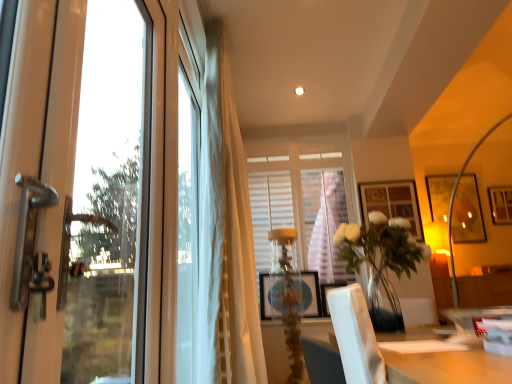
Based on the photo, what is the approximate height of wooden picture frame at upper right, which is the first picture frame from back to front?

It is 40.49 centimeters.

Image resolution: width=512 pixels, height=384 pixels. Describe the element at coordinates (392, 202) in the screenshot. I see `wooden framed picture at center right, positioned as the 3th picture frame in front-to-back order` at that location.

Where is `wooden picture frame at upper right, which is the fifth picture frame from left to right`? This screenshot has height=384, width=512. wooden picture frame at upper right, which is the fifth picture frame from left to right is located at coordinates (500, 204).

Which object is closer to the camera, wooden framed picture at center right, which ranks as the 3th picture frame in back-to-front order, or clear glass door at left, the first window positioned from the left?

clear glass door at left, the first window positioned from the left, is more forward.

Is wooden framed picture at center right, the 3th picture frame in the left-to-right sequence, situated inside clear glass door at left, the first window positioned from the left, or outside?

wooden framed picture at center right, the 3th picture frame in the left-to-right sequence, is located beyond the bounds of clear glass door at left, the first window positioned from the left.

Who is smaller, wooden framed picture at center right, which ranks as the 3th picture frame in back-to-front order, or clear glass door at left, which is counted as the 2th window, starting from the right?

wooden framed picture at center right, which ranks as the 3th picture frame in back-to-front order, is smaller.

From a real-world perspective, which object stands above the other?

matte black picture frame at center, the 5th picture frame in the back-to-front sequence.

How distant is matte black picture frame at center, which appears as the 1th picture frame when viewed from the front, from white glossy table at lower right?

They are 2.08 meters apart.

Does matte black picture frame at center, the second picture frame from the left, have a greater height compared to white glossy table at lower right?

No.

Can you tell me how much matte black picture frame at center, marked as the fourth picture frame in a right-to-left arrangement, and white glossy table at lower right differ in facing direction?

87.4 degrees.

Which of these two, clear glass door at left, which is the 2th window from back to front, or clear glass vase at center, is wider?

Wider between the two is clear glass vase at center.

Where is `window in front of the clear glass vase at center`? Image resolution: width=512 pixels, height=384 pixels. window in front of the clear glass vase at center is located at coordinates (93, 191).

Who is more distant, clear glass door at left, which is counted as the 2th window, starting from the right, or clear glass vase at center?

clear glass vase at center is behind.

Are clear glass door at left, the first window positioned from the left, and clear glass vase at center making contact?

No, clear glass door at left, the first window positioned from the left, is not in contact with clear glass vase at center.

Who is smaller, matte black picture frame at center, which appears as the 1th picture frame when viewed from the front, or clear glass door at left, which is the 2th window from back to front?

matte black picture frame at center, which appears as the 1th picture frame when viewed from the front, is smaller.

Looking at this image, from the image's perspective, is matte black picture frame at center, the 5th picture frame in the back-to-front sequence, above clear glass door at left, which is the 2th window from back to front?

Actually, matte black picture frame at center, the 5th picture frame in the back-to-front sequence, appears below clear glass door at left, which is the 2th window from back to front, in the image.

Is there a large distance between matte black picture frame at center, marked as the fourth picture frame in a right-to-left arrangement, and clear glass door at left, which is the 2th window from back to front?

matte black picture frame at center, marked as the fourth picture frame in a right-to-left arrangement, is far away from clear glass door at left, which is the 2th window from back to front.

Between matte black picture frame at center, which appears as the 1th picture frame when viewed from the front, and clear glass door at left, which is counted as the 2th window, starting from the right, which one has larger width?

Wider between the two is clear glass door at left, which is counted as the 2th window, starting from the right.

Between white matte window at center, arranged as the 2th window when viewed from the front, and clear glass door at left, the first window positioned from the left, which one has smaller width?

With smaller width is white matte window at center, arranged as the 2th window when viewed from the front.

Does white matte window at center, the 1th window from the back, appear on the right side of clear glass door at left, which is counted as the 2th window, starting from the right?

Yes.

Is white matte window at center, the 1th window from the back, positioned behind clear glass door at left, the 1th window viewed from the front?

Yes, it is behind clear glass door at left, the 1th window viewed from the front.

From the image's perspective, is white matte window at center, which ranks as the first window in right-to-left order, located above or below clear glass door at left, which is the 2th window from back to front?

white matte window at center, which ranks as the first window in right-to-left order, is situated lower than clear glass door at left, which is the 2th window from back to front, in the image.

Is wooden framed picture at center right, positioned as the 3th picture frame in front-to-back order, at the right side of white glossy table at lower right?

Correct, you'll find wooden framed picture at center right, positioned as the 3th picture frame in front-to-back order, to the right of white glossy table at lower right.

Which is in front, wooden framed picture at center right, the 3th picture frame in the right-to-left sequence, or white glossy table at lower right?

white glossy table at lower right is closer to the camera.

Measure the distance from wooden framed picture at center right, the 3th picture frame in the right-to-left sequence, to white glossy table at lower right.

wooden framed picture at center right, the 3th picture frame in the right-to-left sequence, is 6.34 feet away from white glossy table at lower right.

Considering the sizes of objects wooden framed picture at center right, which ranks as the 3th picture frame in back-to-front order, and white glossy table at lower right in the image provided, who is taller, wooden framed picture at center right, which ranks as the 3th picture frame in back-to-front order, or white glossy table at lower right?

wooden framed picture at center right, which ranks as the 3th picture frame in back-to-front order.

From the picture: Is white sheer curtain at center inside white matte window at center, which is the second window in left-to-right order?

No, white sheer curtain at center is located outside of white matte window at center, which is the second window in left-to-right order.

Is white matte window at center, which ranks as the first window in right-to-left order, not close to white sheer curtain at center?

Indeed, white matte window at center, which ranks as the first window in right-to-left order, is not near white sheer curtain at center.

Between white matte window at center, the 1th window from the back, and white sheer curtain at center, which one has more height?

Standing taller between the two is white sheer curtain at center.

Between point (283, 225) and point (243, 303), which one is positioned behind?

The point (283, 225) is farther from the camera.

Where is `the 2nd window in front of the wooden framed picture at center right, the 3th picture frame in the right-to-left sequence, counting from the anchor's position`? the 2nd window in front of the wooden framed picture at center right, the 3th picture frame in the right-to-left sequence, counting from the anchor's position is located at coordinates (93, 191).

This screenshot has height=384, width=512. What are the coordinates of `table that is on the right side of matte black picture frame at center, which appears as the 1th picture frame when viewed from the front` in the screenshot? It's located at (448, 366).

From the image, which object appears to be nearer to gold-framed picture at right, which ranks as the 4th picture frame in left-to-right order, wooden picture frame at upper right, which is the first picture frame from back to front, or wooden framed picture at center right, which ranks as the 3th picture frame in back-to-front order?

The object closer to gold-framed picture at right, which ranks as the 4th picture frame in left-to-right order, is wooden picture frame at upper right, which is the first picture frame from back to front.

When comparing their distances from wooden framed picture at center right, the 3th picture frame in the right-to-left sequence, does clear glass door at left, which is counted as the 2th window, starting from the right, or transparent glass window screen at left seem closer?

clear glass door at left, which is counted as the 2th window, starting from the right, is closer to wooden framed picture at center right, the 3th picture frame in the right-to-left sequence.

Based on their spatial positions, is gold-framed picture at right, marked as the second picture frame in a back-to-front arrangement, or white matte window at center, the 1th window from the back, further from transparent glass window screen at left?

gold-framed picture at right, marked as the second picture frame in a back-to-front arrangement, is further to transparent glass window screen at left.

From the image, which object appears to be farther from clear glass vase at center, matte black picture frame at center, the 5th picture frame in the back-to-front sequence, or wooden framed picture at center right, the 3th picture frame in the left-to-right sequence?

Based on the image, matte black picture frame at center, the 5th picture frame in the back-to-front sequence, appears to be further to clear glass vase at center.

Considering their positions, is matte wooden picture frame at center, the 1th picture frame viewed from the left, positioned closer to clear glass vase at center than clear glass door at left, the 1th window viewed from the front?

matte wooden picture frame at center, the 1th picture frame viewed from the left, is positioned closer to the anchor clear glass vase at center.

From the image, which object appears to be nearer to clear glass vase at center, white sheer curtain at center or wooden framed picture at center right, which ranks as the 3th picture frame in back-to-front order?

wooden framed picture at center right, which ranks as the 3th picture frame in back-to-front order, lies closer to clear glass vase at center than the other object.

When comparing their distances from clear glass door at left, which is counted as the 2th window, starting from the right, does transparent glass window screen at left or wooden picture frame at upper right, which ranks as the 5th picture frame in front-to-back order, seem further?

wooden picture frame at upper right, which ranks as the 5th picture frame in front-to-back order, is positioned further to the anchor clear glass door at left, which is counted as the 2th window, starting from the right.

Estimate the real-world distances between objects in this image. Which object is further from wooden framed picture at center right, the 3th picture frame in the right-to-left sequence, wooden picture frame at upper right, which is the fifth picture frame from left to right, or white glossy table at lower right?

white glossy table at lower right is further to wooden framed picture at center right, the 3th picture frame in the right-to-left sequence.

Locate an element on the screen. This screenshot has width=512, height=384. houseplant located between transparent glass window screen at left and white matte window at center, arranged as the 2th window when viewed from the front, in the depth direction is located at coordinates pyautogui.click(x=381, y=261).

Where is `houseplant between white glossy table at lower right and white matte window at center, which is the second window in left-to-right order, along the z-axis`? This screenshot has height=384, width=512. houseplant between white glossy table at lower right and white matte window at center, which is the second window in left-to-right order, along the z-axis is located at coordinates (381, 261).

Find the location of a particular element. The width and height of the screenshot is (512, 384). curtain between clear glass door at left, which is counted as the 2th window, starting from the right, and translucent glass table lamp at center, along the z-axis is located at coordinates (225, 235).

Where is `houseplant between white glossy table at lower right and matte black picture frame at center, marked as the fourth picture frame in a right-to-left arrangement, from front to back`? houseplant between white glossy table at lower right and matte black picture frame at center, marked as the fourth picture frame in a right-to-left arrangement, from front to back is located at coordinates (381, 261).